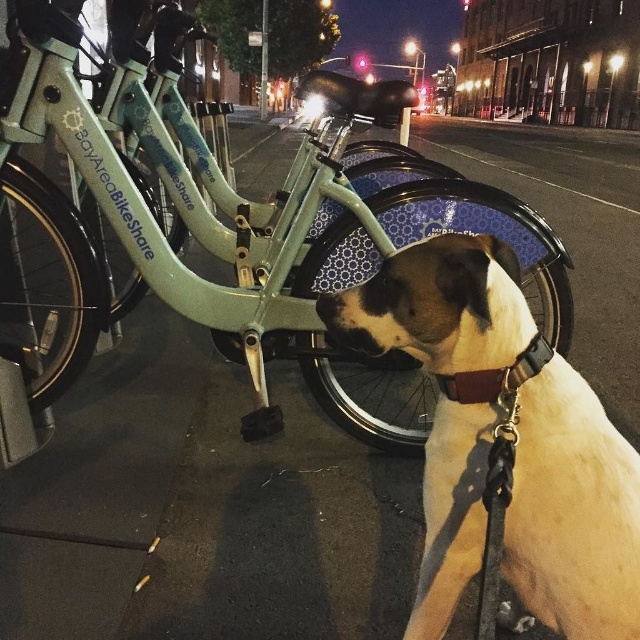
Looking at this image, you are a delivery person needing to pass between the matte green bicycle at center and the white fur dog at center. The delivery cart you are pushing is 1.2 meters wide. Can you fit through the space between them?

The matte green bicycle at center might be wider than white fur dog at center, so the space between them may not be wide enough for your 1.2 meter delivery cart. You should check the width before proceeding.

You are a delivery person who needs to pick up a bike from the Bay Area Bike Share. The bike you need is located at point (234, 228). Can you confirm if the bike at that point is the correct one based on the description provided?

The bike at point (234, 228) is a matte green bicycle at center, which matches the description of the Bay Area Bike Share bicycle. Yes, it is the correct one.